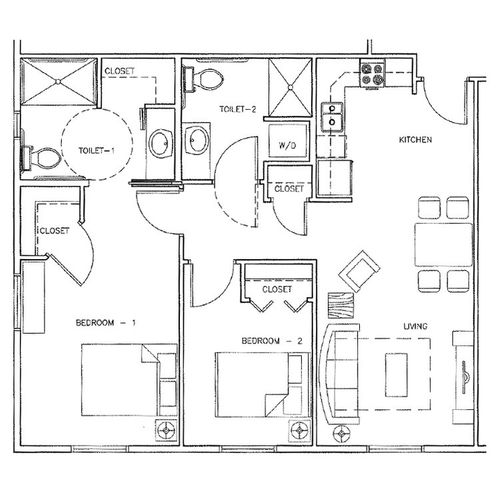
I want to click on living room area, so click(390, 313), click(439, 315), click(436, 372), click(408, 425), click(395, 263).